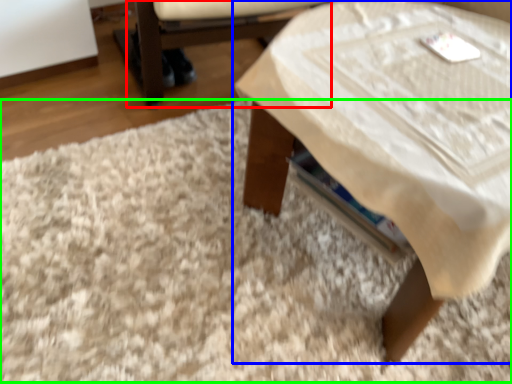
Question: Which is nearer to the armchair (highlighted by a red box)? table (highlighted by a blue box) or mat (highlighted by a green box).

Choices:
 (A) table
 (B) mat

Answer: (B)